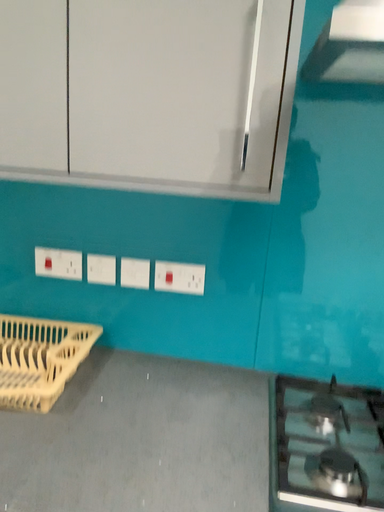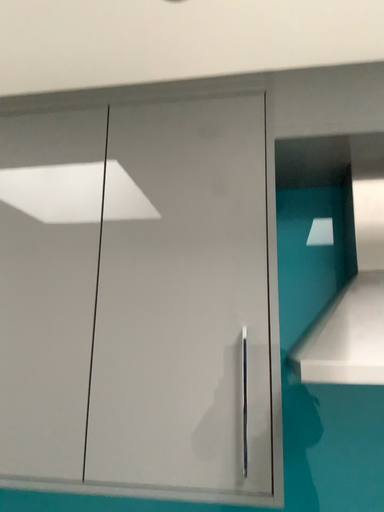
Question: Which way did the camera rotate in the video?

Choices:
 (A) rotated upward
 (B) rotated downward

Answer: (A)